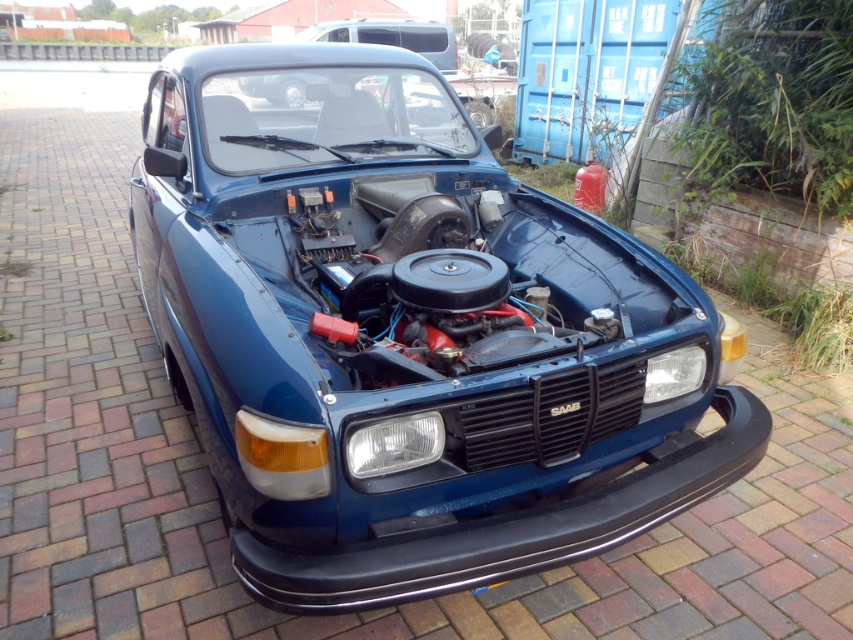
Between glossy blue car at center and matte blue car at center, which one appears on the right side from the viewer's perspective?

glossy blue car at center is more to the right.

Who is more forward, (579, 240) or (415, 51)?

Point (579, 240)

Is point (241, 401) closer to viewer compared to point (381, 92)?

Yes.

The height and width of the screenshot is (640, 853). Identify the location of glossy blue car at center. (409, 337).